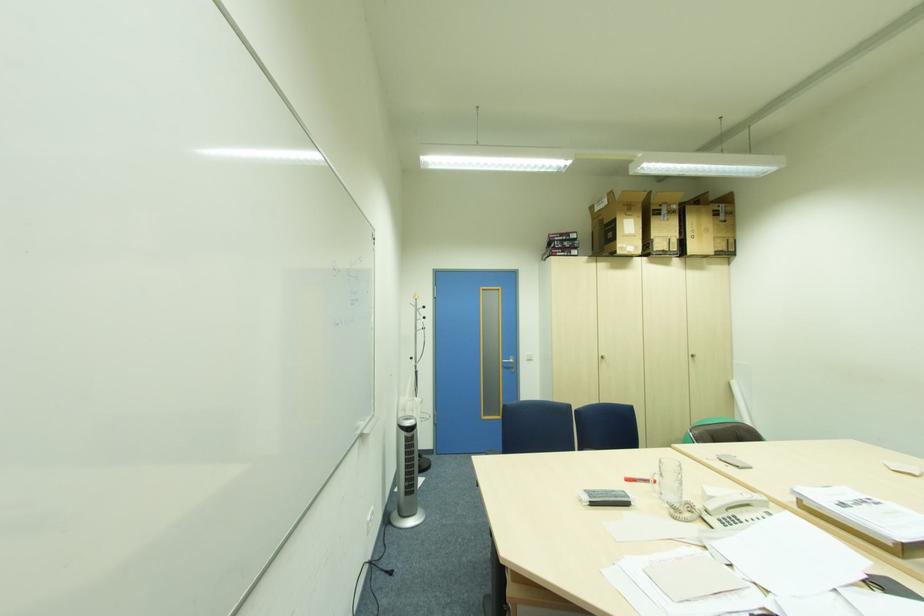
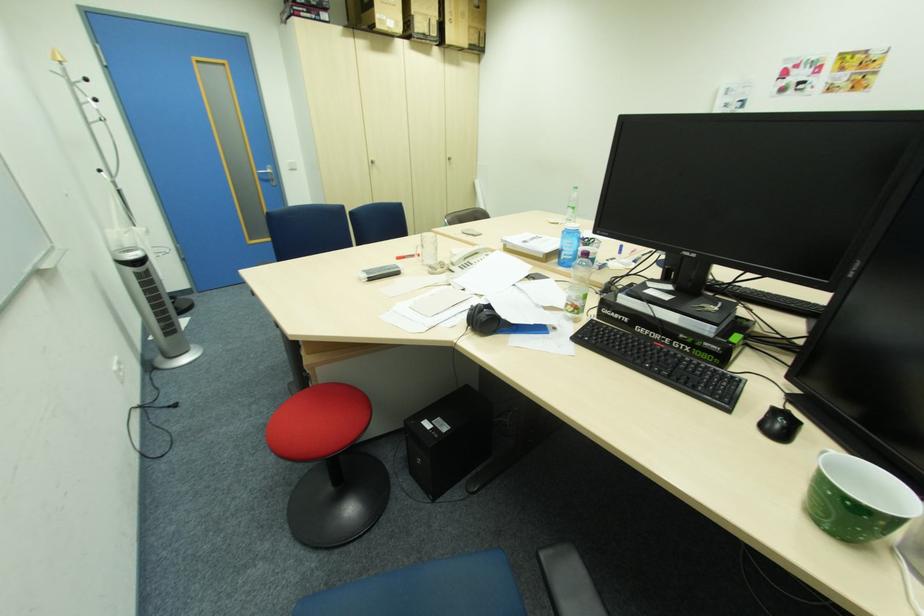
In the second image, find the point that corresponds to the point at 681,248 in the first image.

(441, 31)